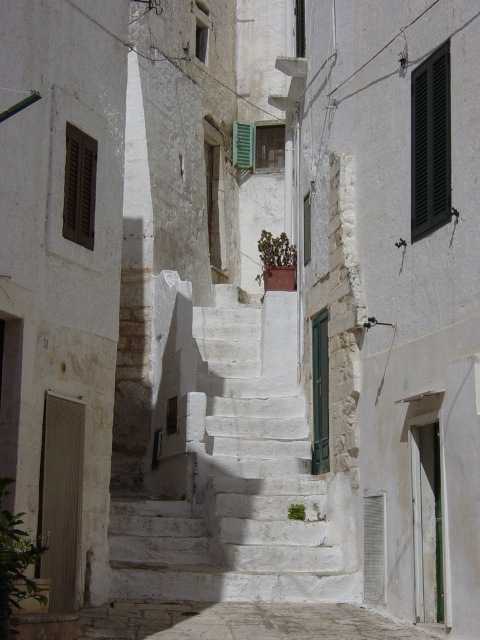
Does green matte door at center have a larger size compared to green leafy plant at center?

Yes.

Looking at this image, is green matte door at center shorter than green leafy plant at center?

No, green matte door at center is not shorter than green leafy plant at center.

This screenshot has height=640, width=480. Find the location of `green matte door at center`. green matte door at center is located at coordinates (320, 392).

This screenshot has height=640, width=480. In order to click on green matte door at center in this screenshot , I will do `click(320, 392)`.

Is black matte shutters at upper right smaller than green leafy plant at center?

Actually, black matte shutters at upper right might be larger than green leafy plant at center.

Is black matte shutters at upper right wider than green leafy plant at center?

Yes.

Locate an element on the screen. This screenshot has width=480, height=640. black matte shutters at upper right is located at coordinates (430, 144).

Can you confirm if brown wooden shutter at upper left is wider than green matte plant at center?

No.

Between brown wooden shutter at upper left and green matte plant at center, which one is positioned higher?

brown wooden shutter at upper left is above.

Is point (72, 157) less distant than point (290, 280)?

Yes, it is.

Image resolution: width=480 pixels, height=640 pixels. I want to click on brown wooden shutter at upper left, so click(x=79, y=186).